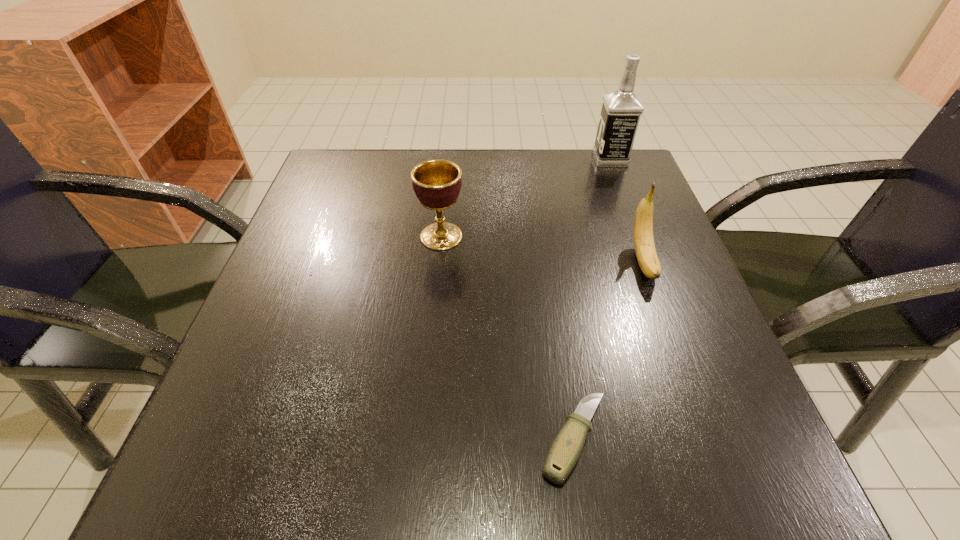
This screenshot has width=960, height=540. In order to click on unoccupied area between the nearest object and the chalice in this screenshot , I will do `click(508, 338)`.

Locate an element on the screen. The image size is (960, 540). vacant area that lies between the leftmost object and the vodka is located at coordinates (526, 198).

Identify the location of free spot between the leftmost object and the vodka. (526, 198).

Identify which object is located as the nearest to the banana. Please provide its 2D coordinates. Your answer should be formatted as a tuple, i.e. [(x, y)], where the tuple contains the x and y coordinates of a point satisfying the conditions above.

[(565, 451)]

Identify which object is the third closest to the shortest object. Please provide its 2D coordinates. Your answer should be formatted as a tuple, i.e. [(x, y)], where the tuple contains the x and y coordinates of a point satisfying the conditions above.

[(621, 110)]

This screenshot has height=540, width=960. I want to click on free region that satisfies the following two spatial constraints: 1. on the front side of the second object from left to right; 2. on the left side of the chalice, so [422, 440].